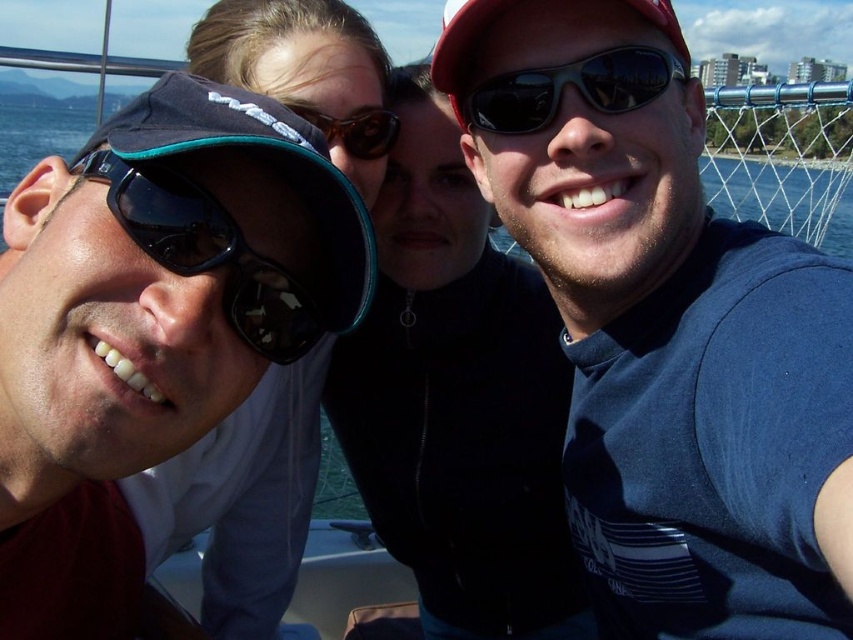
Between matte black jacket at center and brown reflective sunglasses at center, which one appears on the right side from the viewer's perspective?

matte black jacket at center is more to the right.

What do you see at coordinates (457, 397) in the screenshot?
I see `matte black jacket at center` at bounding box center [457, 397].

I want to click on matte black jacket at center, so click(457, 397).

Which of these two, matte black goggles at left or sunglasses at center, stands taller?

Standing taller between the two is matte black goggles at left.

Between matte black goggles at left and sunglasses at center, which one has less height?

sunglasses at center

Is point (236, 323) closer to camera compared to point (593, 97)?

That is True.

This screenshot has height=640, width=853. Identify the location of matte black goggles at left. (207, 250).

How much distance is there between blue fabric shirt at center and matte black jacket at center?

A distance of 3.25 meters exists between blue fabric shirt at center and matte black jacket at center.

From the picture: Who is more distant from viewer, (531, 172) or (555, 493)?

Positioned behind is point (555, 493).

You are a GUI agent. You are given a task and a screenshot of the screen. Output one action in this format:
    pyautogui.click(x=<x>, y=<y>)
    Task: Click on the blue fabric shirt at center
    
    Given the screenshot: What is the action you would take?
    pyautogui.click(x=665, y=326)